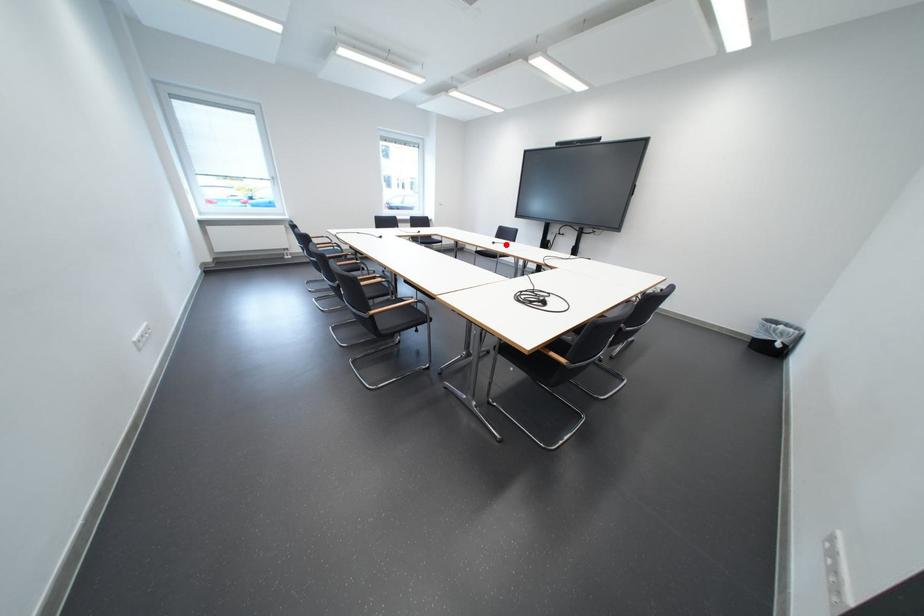
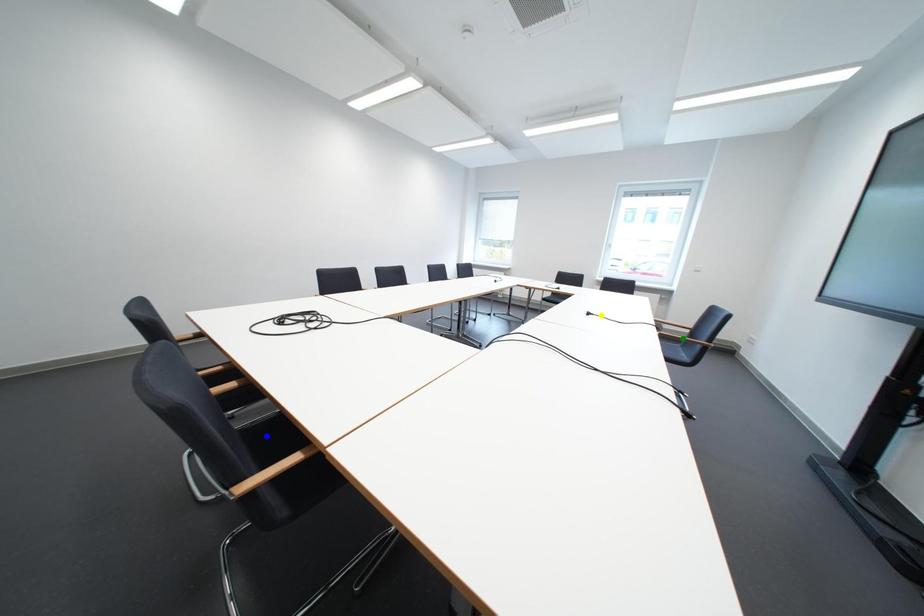
Question: I am providing you with two images of the same scene from different viewpoints. A red point is marked on the first image. You are given multiple points on the second image. Can you choose the point in image 2 that corresponds to the point in image 1?

Choices:
 (A) blue point
 (B) yellow point
 (C) green point

Answer: (B)